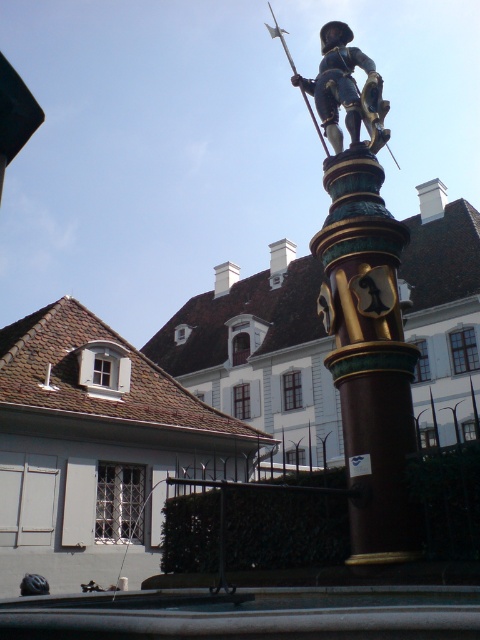
The image size is (480, 640). I want to click on gold polished pillar at center, so click(x=368, y=353).

Who is taller, gold polished pillar at center or polished bronze statue at center?

polished bronze statue at center

Measure the distance between gold polished pillar at center and camera.

gold polished pillar at center and camera are 26.43 feet apart.

Find the location of a particular element. Image resolution: width=480 pixels, height=640 pixels. gold polished pillar at center is located at coordinates (368, 353).